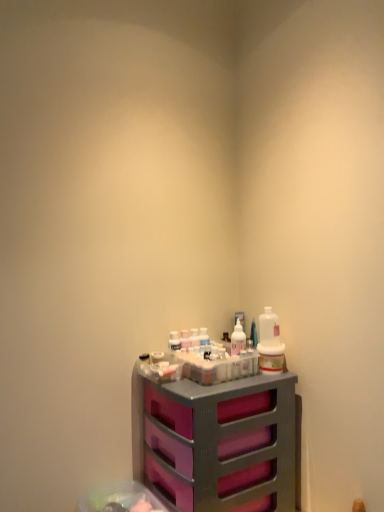
Identify the location of plastic/pink drawer unit at center. The width and height of the screenshot is (384, 512). (215, 442).

Describe the element at coordinates (215, 442) in the screenshot. I see `plastic/pink drawer unit at center` at that location.

The image size is (384, 512). I want to click on plastic/pink drawer unit at center, so click(215, 442).